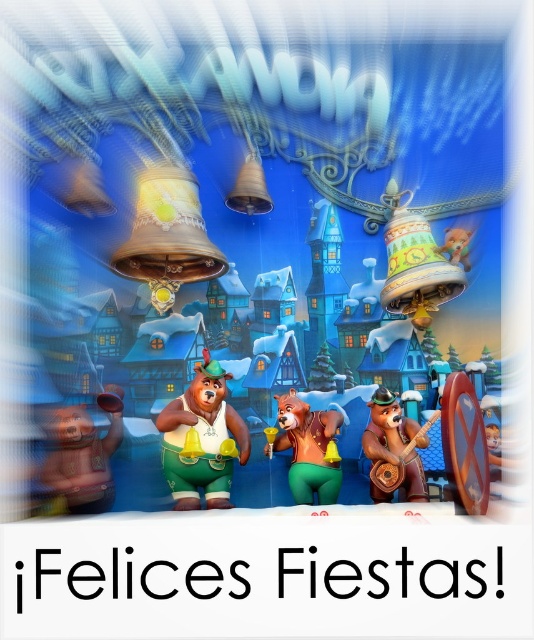
You are standing in front of a festive holiday scene with animated bears. You see a green matte bear at center. If you want to give this bear a high five, will you be able to reach it from your current position?

The green matte bear at center and viewer are 3.72 feet apart from each other. Since 3.72 feet is approximately 44.64 inches, which is within typical human arm reach, you can likely reach out to give the green matte bear at center a high five from your current position.

You are standing in the center of the image and want to move towards the green matte bear at center. Which direction should you move to reach it?

The green matte bear at center is located at point coordinates of 0.686 on the x axis and 0.378 on the y axis. Since you are currently at the center of the image, which is typically at coordinates 0.5 on both axes, you should move to the right and slightly downward to reach the green matte bear at center.

You are a photographer standing at the center of the scene. You want to take a photo of the matte gold bear at lower left. According to the coordinates provided, where should you aim your camera to capture the bear in the frame?

The matte gold bear at lower left is located at coordinates point [82,454], so you should aim your camera towards that point to capture it in the frame.